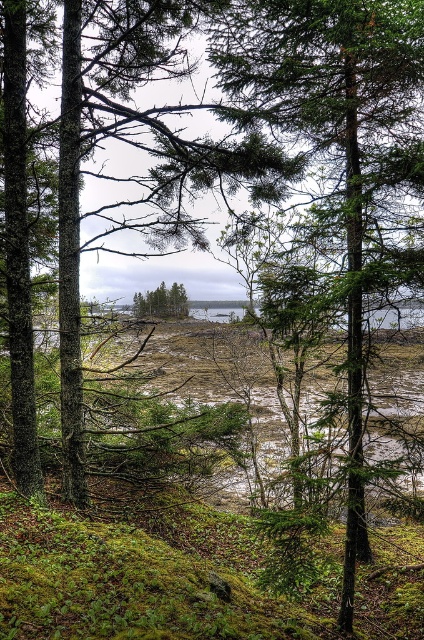
Looking at this image, is green textured tree at center closer to camera compared to green matte tree at center?

Yes, it is.

From the picture: Does green textured tree at center have a smaller size compared to green matte tree at center?

Actually, green textured tree at center might be larger than green matte tree at center.

Is point (248, 38) farther from viewer compared to point (181, 301)?

No, (248, 38) is closer to viewer.

In order to click on green textured tree at center in this screenshot , I will do `click(334, 141)`.